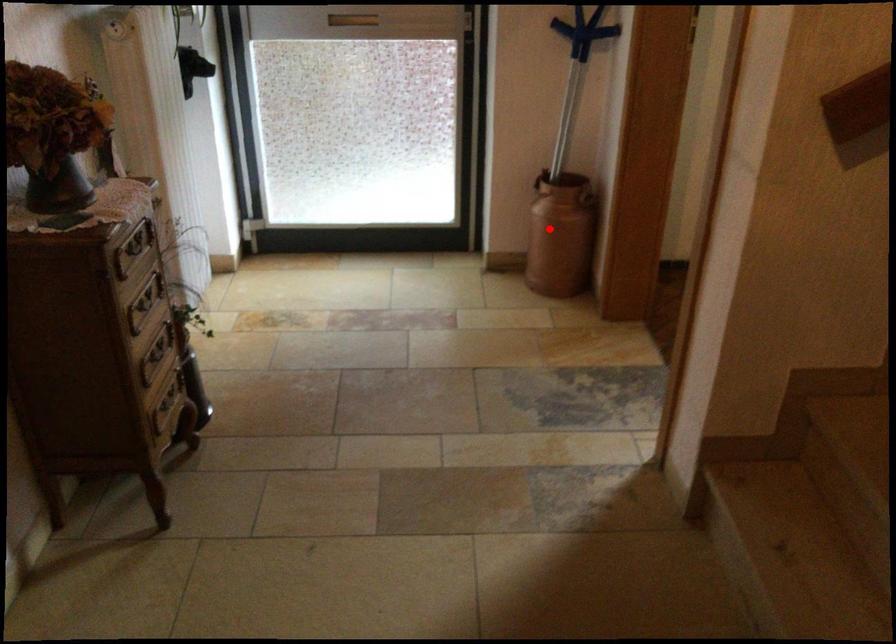
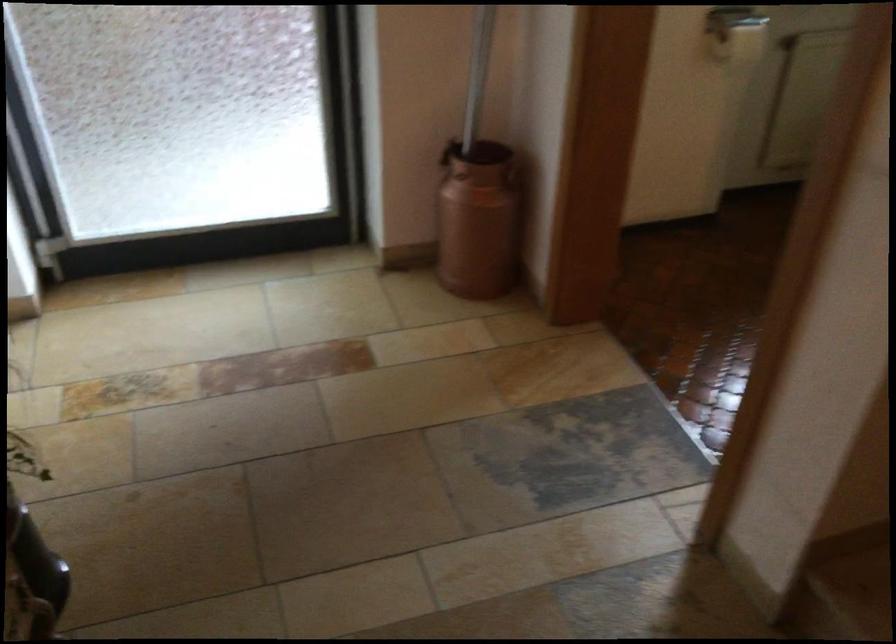
Question: I am providing you with two images of the same scene from different viewpoints. In image1, a red point is highlighted. Considering the same 3D point in image2, which of the following is correct?

Choices:
 (A) It is closer
 (B) It is farther

Answer: (A)